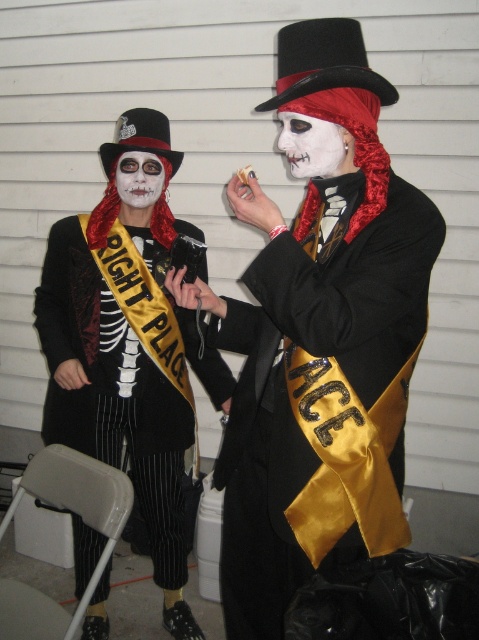
Image resolution: width=479 pixels, height=640 pixels. Find the location of `white matte face at center`. white matte face at center is located at coordinates (310, 145).

Is white matte face at center bigger than white matte face paint at center?

Correct, white matte face at center is larger in size than white matte face paint at center.

Where is `white matte face at center`? The image size is (479, 640). white matte face at center is located at coordinates (310, 145).

Locate an element on the screen. This screenshot has height=640, width=479. white matte face at center is located at coordinates (310, 145).

Which is above, matte black coat at center or white matte face at center?

Positioned higher is white matte face at center.

Is matte black coat at center above white matte face at center?

No.

You are a GUI agent. You are given a task and a screenshot of the screen. Output one action in this format:
    pyautogui.click(x=<x>, y=<y>)
    Task: Click on the matte black coat at center
    Image resolution: width=479 pixels, height=640 pixels.
    Given the screenshot: What is the action you would take?
    pyautogui.click(x=113, y=392)

Does matte black coat at center have a larger size compared to white matte face paint at center?

Yes, matte black coat at center is bigger than white matte face paint at center.

Can you confirm if matte black coat at center is positioned above white matte face paint at center?

Actually, matte black coat at center is below white matte face paint at center.

The height and width of the screenshot is (640, 479). What do you see at coordinates (113, 392) in the screenshot? I see `matte black coat at center` at bounding box center [113, 392].

Where is `matte black coat at center`? The image size is (479, 640). matte black coat at center is located at coordinates (113, 392).